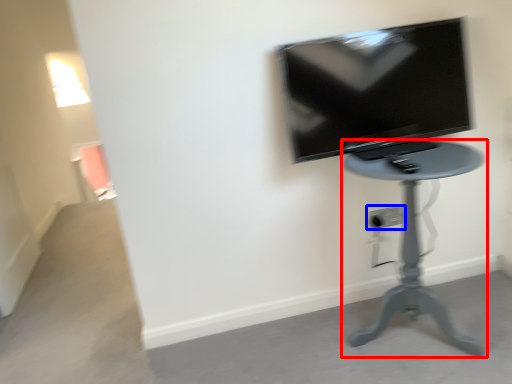
Question: Which point is further to the camera, furniture (highlighted by a red box) or electric outlet (highlighted by a blue box)?

Choices:
 (A) furniture
 (B) electric outlet

Answer: (B)